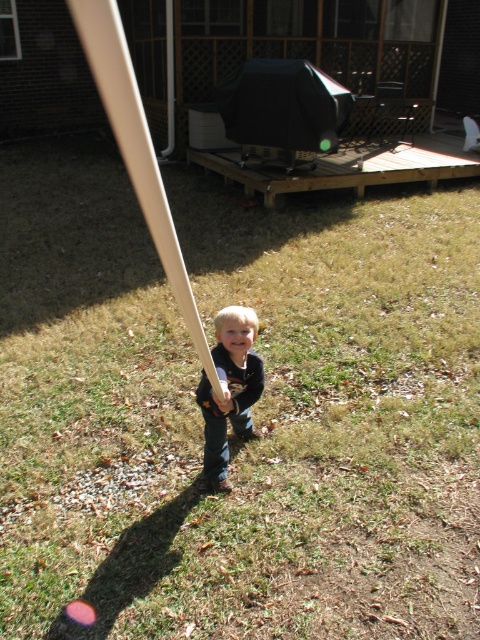
Does white matte baseball bat at center appear on the left side of smooth brown bat at center?

Indeed, white matte baseball bat at center is positioned on the left side of smooth brown bat at center.

Is point (132, 97) positioned in front of point (233, 420)?

Yes.

I want to click on white matte baseball bat at center, so click(x=139, y=154).